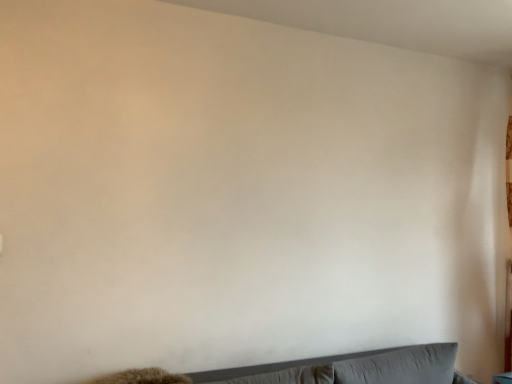
Question: From the image's perspective, is gray fabric couch at lower center beneath gray fabric pillow at lower center, acting as the 2th pillow starting from the right?

Choices:
 (A) no
 (B) yes

Answer: (B)

Question: Considering the relative positions of gray fabric couch at lower center and gray fabric pillow at lower center, acting as the 2th pillow starting from the right, in the image provided, is gray fabric couch at lower center to the left of gray fabric pillow at lower center, acting as the 2th pillow starting from the right, from the viewer's perspective?

Choices:
 (A) yes
 (B) no

Answer: (B)

Question: Does gray fabric couch at lower center turn towards gray fabric pillow at lower center, acting as the 2th pillow starting from the right?

Choices:
 (A) yes
 (B) no

Answer: (A)

Question: Would you say gray fabric couch at lower center is a long distance from gray fabric pillow at lower center, the 1th pillow viewed from the left?

Choices:
 (A) yes
 (B) no

Answer: (B)

Question: Is gray fabric couch at lower center shorter than gray fabric pillow at lower center, acting as the 2th pillow starting from the right?

Choices:
 (A) yes
 (B) no

Answer: (B)

Question: Considering the relative positions of gray fabric pillow at lower center, the 1th pillow viewed from the left, and gray fabric couch at lower center in the image provided, is gray fabric pillow at lower center, the 1th pillow viewed from the left, to the left or to the right of gray fabric couch at lower center?

Choices:
 (A) right
 (B) left

Answer: (B)

Question: From the image's perspective, is gray fabric pillow at lower center, acting as the 2th pillow starting from the right, above or below gray fabric couch at lower center?

Choices:
 (A) below
 (B) above

Answer: (B)

Question: Considering the positions of gray fabric pillow at lower center, acting as the 2th pillow starting from the right, and gray fabric couch at lower center in the image, is gray fabric pillow at lower center, acting as the 2th pillow starting from the right, bigger or smaller than gray fabric couch at lower center?

Choices:
 (A) small
 (B) big

Answer: (A)

Question: Is point (290, 380) positioned closer to the camera than point (397, 347)?

Choices:
 (A) closer
 (B) farther

Answer: (A)

Question: Is gray fabric pillow at lower center, the 1th pillow viewed from the left, to the left or to the right of gray fabric pillow at lower right, which appears as the second pillow when viewed from the left, in the image?

Choices:
 (A) left
 (B) right

Answer: (A)

Question: Is gray fabric pillow at lower center, the 1th pillow viewed from the left, inside or outside of gray fabric pillow at lower right, which appears as the second pillow when viewed from the left?

Choices:
 (A) outside
 (B) inside

Answer: (A)

Question: From a real-world perspective, is gray fabric pillow at lower center, the 1th pillow viewed from the left, physically located above or below gray fabric pillow at lower right, which appears as the second pillow when viewed from the left?

Choices:
 (A) above
 (B) below

Answer: (A)

Question: Does point (304, 365) appear closer or farther from the camera than point (437, 364)?

Choices:
 (A) closer
 (B) farther

Answer: (A)

Question: Is gray fabric pillow at lower right, arranged as the first pillow when viewed from the right, in front of or behind gray fabric pillow at lower center, acting as the 2th pillow starting from the right, in the image?

Choices:
 (A) behind
 (B) front

Answer: (A)

Question: Is gray fabric pillow at lower right, which appears as the second pillow when viewed from the left, wider or thinner than gray fabric pillow at lower center, the 1th pillow viewed from the left?

Choices:
 (A) thin
 (B) wide

Answer: (A)